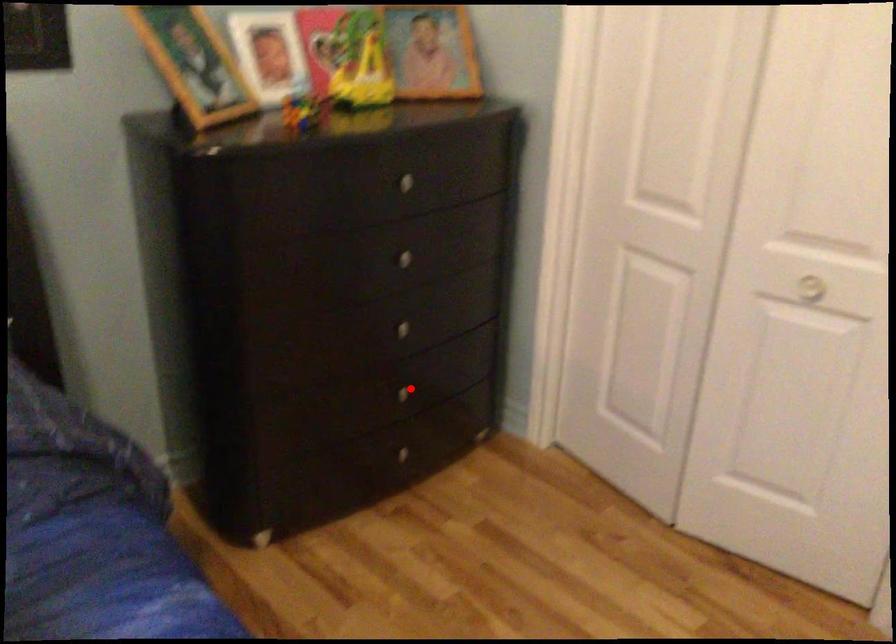
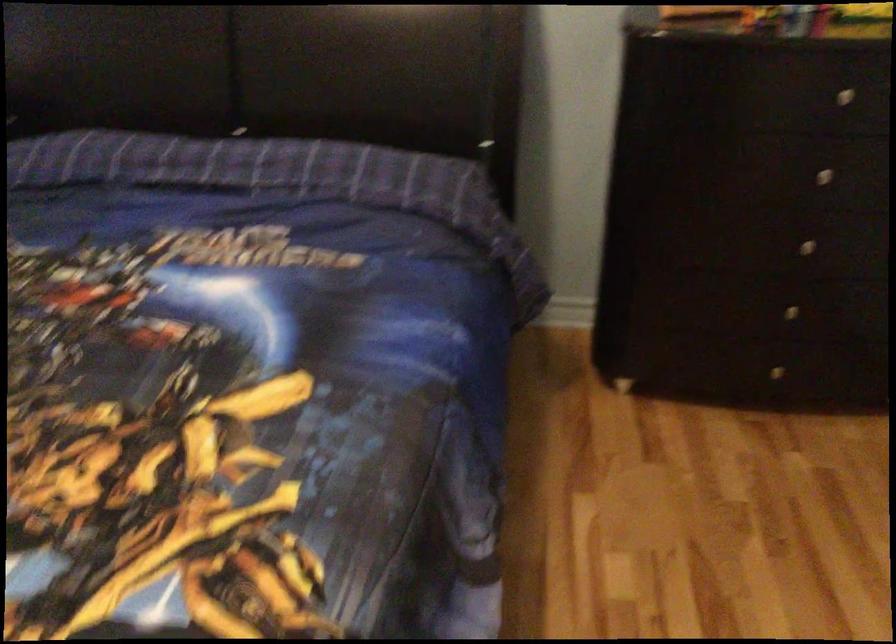
The point at the highlighted location is marked in the first image. Where is the corresponding point in the second image?

(790, 310)